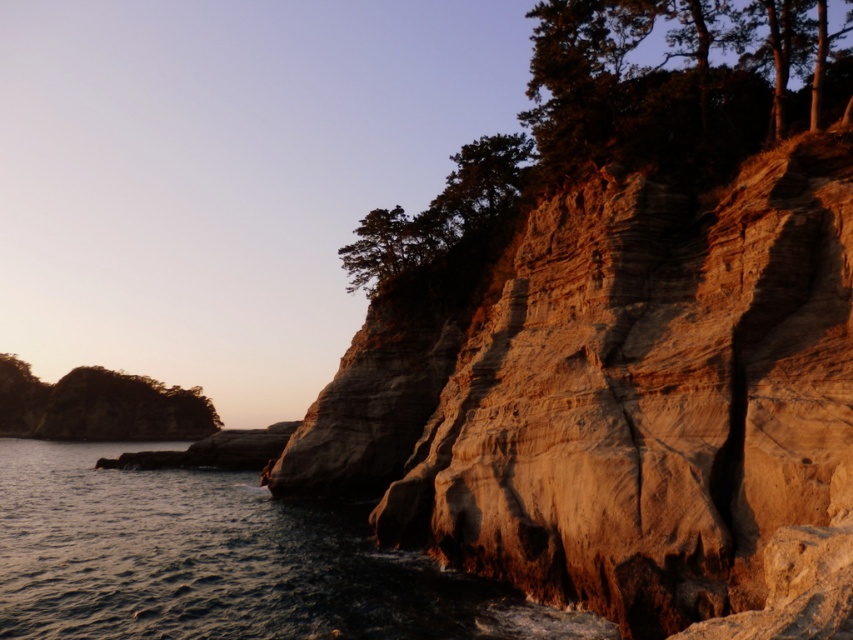
You are standing on the beach and see the rustic stone cliff at right and the dark blue water at lower left. Which object is closer to you?

The rustic stone cliff at right is closer to you since it is in front of the dark blue water at lower left.

You are standing at the center of the image and want to walk towards the dark green textured tree at upper right. Which direction should you face to ensure you are moving toward it while avoiding the dark blue water at lower left?

You should face toward the upper right direction to move toward the dark green textured tree at upper right while avoiding the dark blue water at lower left, since the dark blue water at lower left is located to the left of the dark green textured tree at upper right.